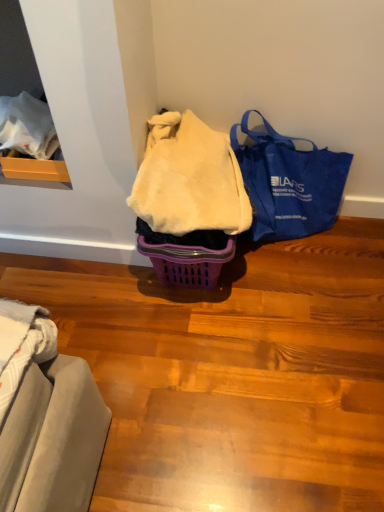
Question: Is white fluffy blanket at center to the right of blue canvas tote bag at right from the viewer's perspective?

Choices:
 (A) yes
 (B) no

Answer: (B)

Question: Is white fluffy blanket at center thinner than blue canvas tote bag at right?

Choices:
 (A) no
 (B) yes

Answer: (A)

Question: From the image's perspective, would you say white fluffy blanket at center is shown under blue canvas tote bag at right?

Choices:
 (A) yes
 (B) no

Answer: (B)

Question: Can you see white fluffy blanket at center touching blue canvas tote bag at right?

Choices:
 (A) no
 (B) yes

Answer: (A)

Question: From the image's perspective, is white fluffy blanket at center located above blue canvas tote bag at right?

Choices:
 (A) yes
 (B) no

Answer: (A)

Question: Is white fluffy blanket at center turned away from blue canvas tote bag at right?

Choices:
 (A) no
 (B) yes

Answer: (A)

Question: Is blue canvas tote bag at right oriented away from white fluffy blanket at center?

Choices:
 (A) yes
 (B) no

Answer: (B)

Question: From the image's perspective, is blue canvas tote bag at right on white fluffy blanket at center?

Choices:
 (A) no
 (B) yes

Answer: (A)

Question: Would you consider blue canvas tote bag at right to be distant from white fluffy blanket at center?

Choices:
 (A) yes
 (B) no

Answer: (B)

Question: Is blue canvas tote bag at right aimed at white fluffy blanket at center?

Choices:
 (A) yes
 (B) no

Answer: (B)

Question: Is blue canvas tote bag at right taller than white fluffy blanket at center?

Choices:
 (A) no
 (B) yes

Answer: (B)

Question: Considering the relative positions of blue canvas tote bag at right and white fluffy blanket at center in the image provided, is blue canvas tote bag at right in front of white fluffy blanket at center?

Choices:
 (A) yes
 (B) no

Answer: (B)

Question: Is point (193, 159) closer or farther from the camera than point (301, 236)?

Choices:
 (A) closer
 (B) farther

Answer: (A)